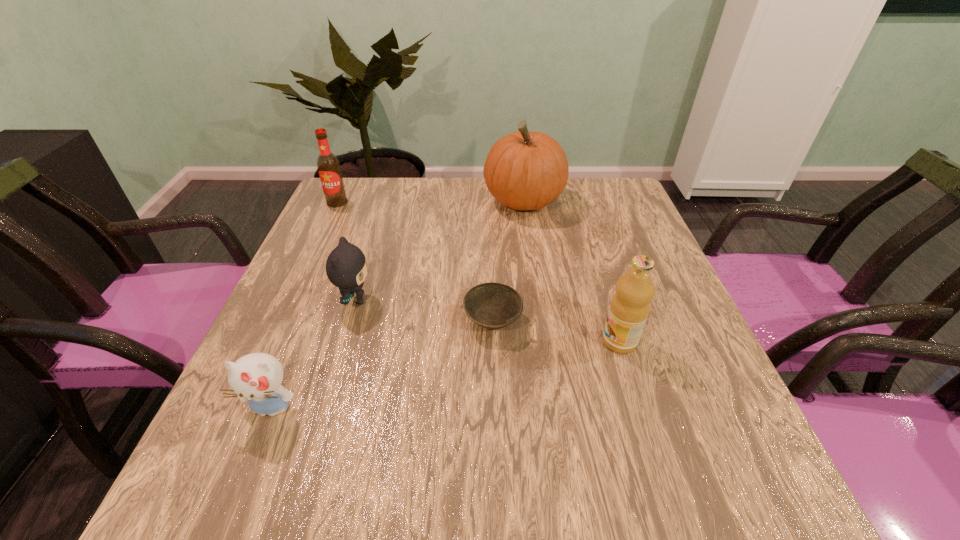
Point out which object is positioned as the fifth nearest to the beer bottle. Please provide its 2D coordinates. Your answer should be formatted as a tuple, i.e. [(x, y)], where the tuple contains the x and y coordinates of a point satisfying the conditions above.

[(629, 308)]

Image resolution: width=960 pixels, height=540 pixels. What are the coordinates of `free location that satisfies the following two spatial constraints: 1. on the back side of the bowl; 2. on the front-facing side of the right kitten` in the screenshot? It's located at 492,300.

Locate an element on the screen. Image resolution: width=960 pixels, height=540 pixels. vacant space that satisfies the following two spatial constraints: 1. on the front-facing side of the farther kitten; 2. on the front-facing side of the nearest object is located at coordinates (322, 408).

The height and width of the screenshot is (540, 960). Find the location of `free space that satisfies the following two spatial constraints: 1. on the front-facing side of the bowl; 2. on the left side of the right kitten`. free space that satisfies the following two spatial constraints: 1. on the front-facing side of the bowl; 2. on the left side of the right kitten is located at coordinates (348, 321).